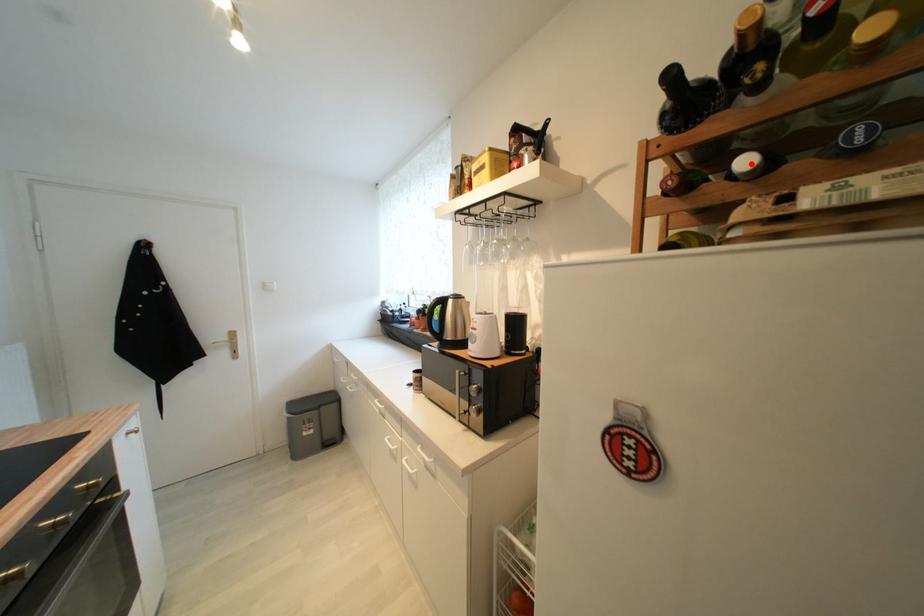
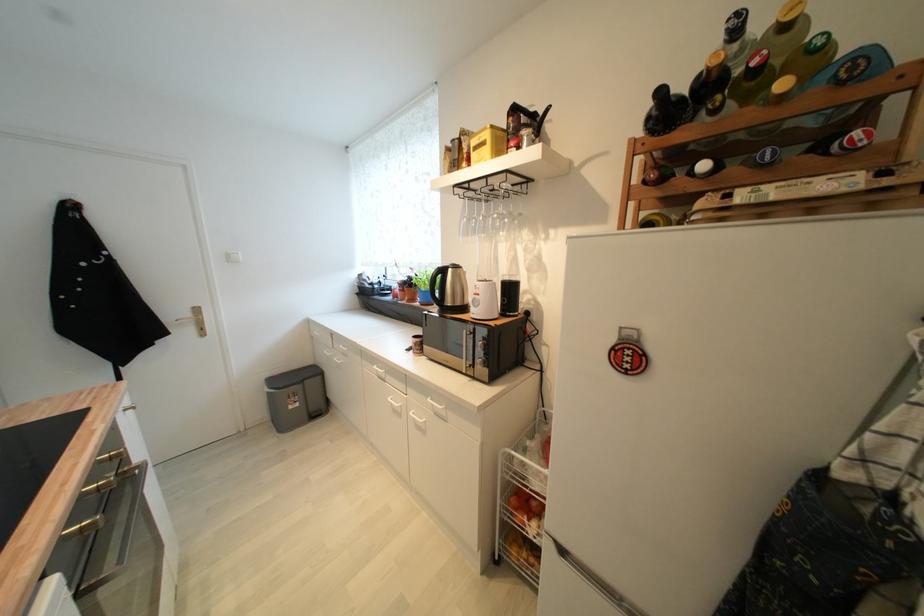
In the second image, find the point that corresponds to the highlighted location in the first image.

(709, 168)